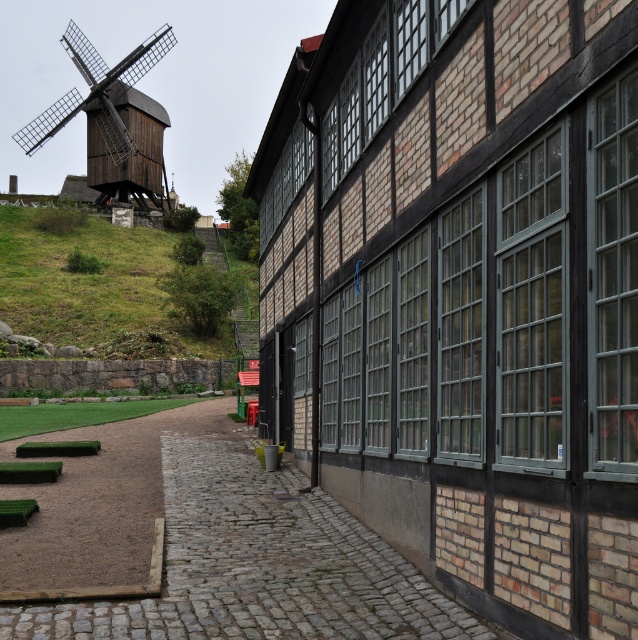
You are standing at the center of the image and want to walk towards the cobblestone path at lower left. Which direction should you move in to reach it?

You should move towards the lower left direction to reach the cobblestone path at lower left as it is located at point (216, 548).

In the scene shown: You are standing at the entrance of the building and want to walk towards the wooden windmill at left. Which direction should you turn to avoid stepping on the green grass at lower left?

You should turn to the left to avoid stepping on the green grass at lower left because the green grass at lower left is to the right of the wooden windmill at left, meaning the windmill is to the left of the grass. Turning left would direct you away from the grass towards the windmill.